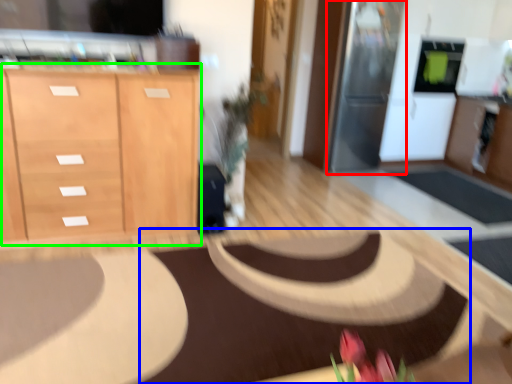
Question: Estimate the real-world distances between objects in this image. Which object is farther from appliance (highlighted by a red box), mat (highlighted by a blue box) or cabinetry (highlighted by a green box)?

Choices:
 (A) mat
 (B) cabinetry

Answer: (B)